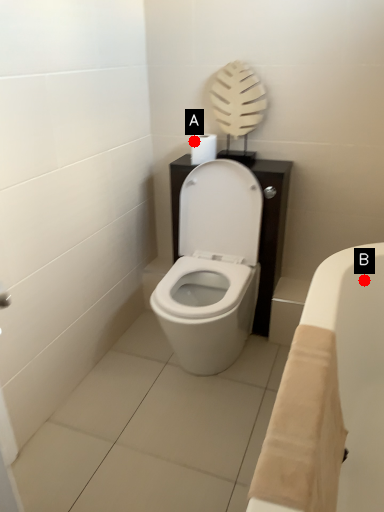
Question: Two points are circled on the image, labeled by A and B beside each circle. Which of the following is the farthest from the observer?

Choices:
 (A) A is further
 (B) B is further

Answer: (A)